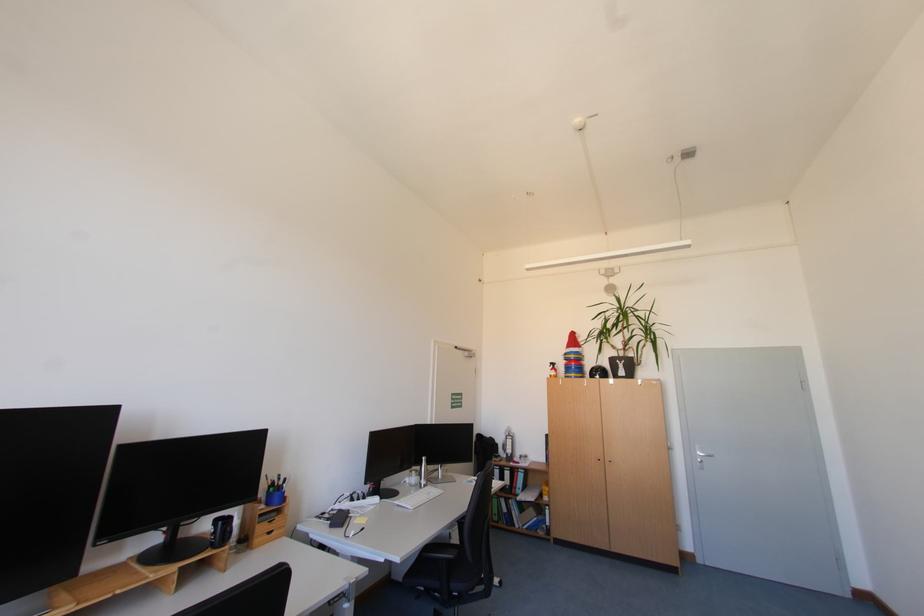
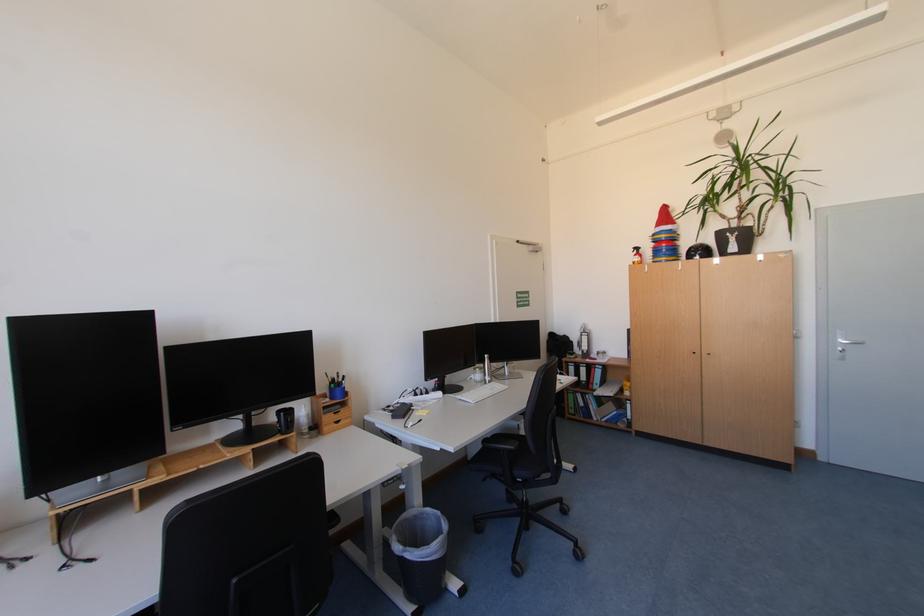
In the second image, find the point that corresponds to point 516,474 in the first image.

(590, 371)